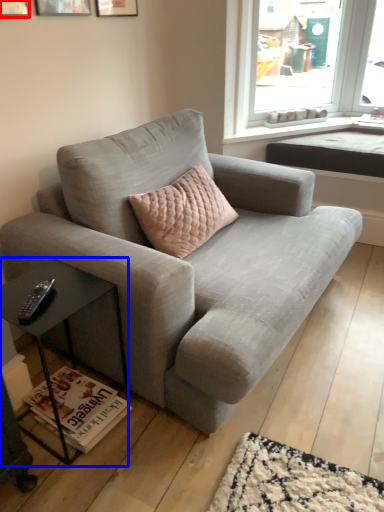
Question: Which of the following is the farthest to the observer, picture frame (highlighted by a red box) or table (highlighted by a blue box)?

Choices:
 (A) picture frame
 (B) table

Answer: (A)